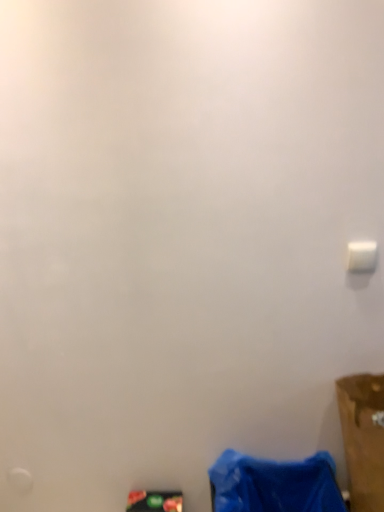
Question: Is matte black phone at lower center, which ranks as the 2th waste in right-to-left order, to the left of blue fabric bag at lower right, the first waste when ordered from right to left, from the viewer's perspective?

Choices:
 (A) yes
 (B) no

Answer: (A)

Question: Is matte black phone at lower center, placed as the 1th waste when sorted from left to right, shorter than blue fabric bag at lower right, acting as the second waste starting from the left?

Choices:
 (A) no
 (B) yes

Answer: (A)

Question: Is matte black phone at lower center, which ranks as the 2th waste in right-to-left order, closer to the viewer compared to blue fabric bag at lower right, the first waste when ordered from right to left?

Choices:
 (A) yes
 (B) no

Answer: (B)

Question: Is matte black phone at lower center, placed as the 1th waste when sorted from left to right, not close to blue fabric bag at lower right, acting as the second waste starting from the left?

Choices:
 (A) yes
 (B) no

Answer: (B)

Question: Can you confirm if matte black phone at lower center, which ranks as the 2th waste in right-to-left order, is taller than blue fabric bag at lower right, the first waste when ordered from right to left?

Choices:
 (A) yes
 (B) no

Answer: (A)

Question: Is blue fabric bag at lower right, acting as the second waste starting from the left, located within matte black phone at lower center, which ranks as the 2th waste in right-to-left order?

Choices:
 (A) yes
 (B) no

Answer: (B)

Question: Is brown cardboard box at lower right located within blue fabric bag at lower right, the first waste when ordered from right to left?

Choices:
 (A) no
 (B) yes

Answer: (A)

Question: From a real-world perspective, is blue fabric bag at lower right, acting as the second waste starting from the left, positioned under brown cardboard box at lower right based on gravity?

Choices:
 (A) no
 (B) yes

Answer: (B)

Question: Considering the relative positions of blue fabric bag at lower right, acting as the second waste starting from the left, and brown cardboard box at lower right in the image provided, is blue fabric bag at lower right, acting as the second waste starting from the left, to the right of brown cardboard box at lower right from the viewer's perspective?

Choices:
 (A) yes
 (B) no

Answer: (B)

Question: Is blue fabric bag at lower right, the first waste when ordered from right to left, shorter than brown cardboard box at lower right?

Choices:
 (A) yes
 (B) no

Answer: (A)

Question: Is blue fabric bag at lower right, acting as the second waste starting from the left, positioned with its back to brown cardboard box at lower right?

Choices:
 (A) no
 (B) yes

Answer: (A)

Question: Is the position of blue fabric bag at lower right, the first waste when ordered from right to left, less distant than that of brown cardboard box at lower right?

Choices:
 (A) no
 (B) yes

Answer: (A)

Question: Is blue fabric bag at lower right, the first waste when ordered from right to left, outside white plastic light switch at upper right?

Choices:
 (A) yes
 (B) no

Answer: (A)